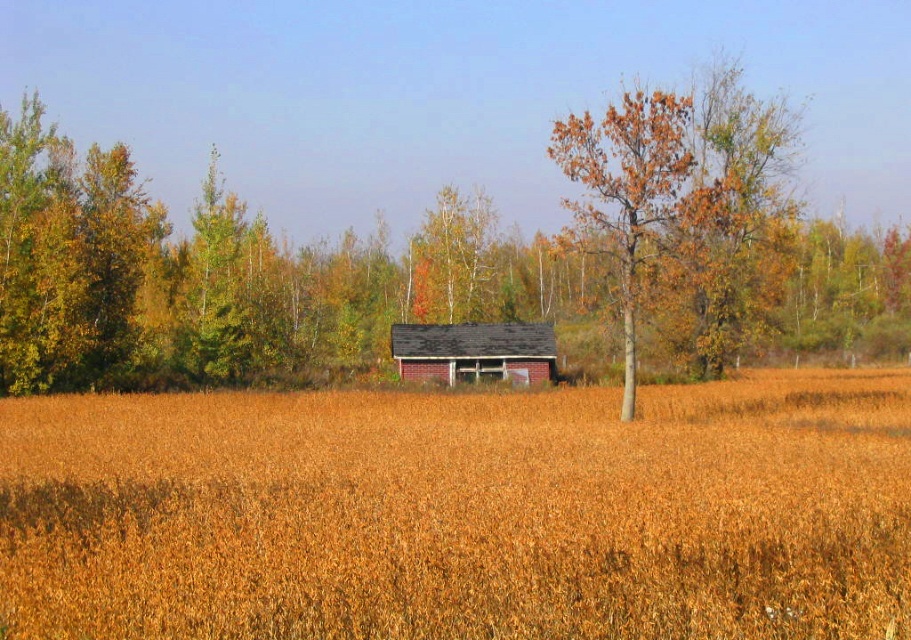
Is brown leafy tree at center wider than brown textured tree at center?

Yes.

Does brown leafy tree at center have a larger size compared to brown textured tree at center?

Yes.

Which is in front, point (89, 298) or point (590, 136)?

Point (590, 136) is more forward.

Image resolution: width=911 pixels, height=640 pixels. Identify the location of brown leafy tree at center. (237, 278).

Is point (622, 186) closer to viewer compared to point (431, 356)?

Yes, it is.

Is point (664, 150) positioned before point (471, 346)?

Yes, point (664, 150) is closer to viewer.

You are a GUI agent. You are given a task and a screenshot of the screen. Output one action in this format:
    pyautogui.click(x=<x>, y=<y>)
    Task: Click on the brown textured tree at center
    The height and width of the screenshot is (640, 911).
    Given the screenshot: What is the action you would take?
    pyautogui.click(x=626, y=189)

Which is in front, point (241, 611) or point (494, 358)?

Positioned in front is point (241, 611).

Is brown matte wheat field at center above dark gray shingles at center?

No, brown matte wheat field at center is not above dark gray shingles at center.

Where is `brown matte wheat field at center`? This screenshot has width=911, height=640. brown matte wheat field at center is located at coordinates (462, 513).